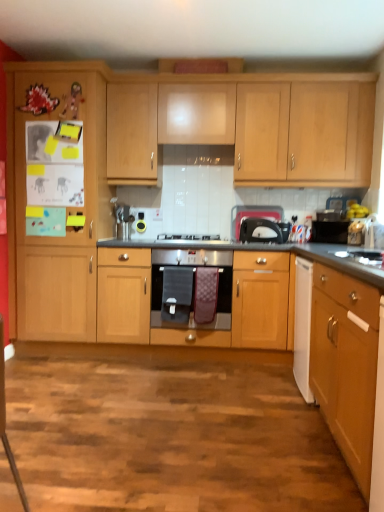
Find the location of a particular element. The width and height of the screenshot is (384, 512). matte black toaster at center is located at coordinates pyautogui.click(x=252, y=215).

Identify the location of satin silver gas stove at center. Image resolution: width=384 pixels, height=512 pixels. (188, 237).

Describe the element at coordinates (64, 205) in the screenshot. The width and height of the screenshot is (384, 512). I see `wooden cabinet at left, the 2th cabinetry in the back-to-front sequence` at that location.

Describe the element at coordinates (191, 312) in the screenshot. I see `wooden cabinet at center, acting as the 3th cabinetry starting from the back` at that location.

Measure the distance between point (344, 327) and camera.

The distance of point (344, 327) from camera is 1.73 meters.

I want to click on matte black toaster at center, so click(252, 215).

Considering the relative sizes of matte black toaster at center and satin silver gas stove at center in the image provided, is matte black toaster at center smaller than satin silver gas stove at center?

Correct, matte black toaster at center occupies less space than satin silver gas stove at center.

Is matte black toaster at center next to satin silver gas stove at center?

No, matte black toaster at center is not in contact with satin silver gas stove at center.

In the image, is matte black toaster at center on the left side or the right side of satin silver gas stove at center?

Clearly, matte black toaster at center is on the right of satin silver gas stove at center in the image.

From the image's perspective, which object appears higher, matte black toaster at center or satin silver gas stove at center?

matte black toaster at center, from the image's perspective.

From the image's perspective, which one is positioned lower, light wood cabinet at upper center, the 4th cabinetry positioned from the front, or satin silver gas stove at center?

satin silver gas stove at center.

In the scene shown: Is satin silver gas stove at center completely or partially inside light wood cabinet at upper center, the 4th cabinetry positioned from the front?

No, satin silver gas stove at center is not a part of light wood cabinet at upper center, the 4th cabinetry positioned from the front.

Is point (293, 125) in front of point (218, 237)?

Yes, point (293, 125) is closer to viewer.

Considering the positions of objects matte black toaster at center and white glossy sink at right in the image provided, who is in front, matte black toaster at center or white glossy sink at right?

Positioned in front is white glossy sink at right.

This screenshot has width=384, height=512. What are the coordinates of `sink in front of the matte black toaster at center` in the screenshot? It's located at (361, 257).

Is matte black toaster at center not near white glossy sink at right?

No, matte black toaster at center is in close proximity to white glossy sink at right.

Considering the positions of point (287, 268) and point (365, 255), is point (287, 268) closer or farther from the camera than point (365, 255)?

Point (287, 268) is positioned farther from the camera compared to point (365, 255).

Is wooden cabinet at center, which is the 2th cabinetry in front-to-back order, facing away from white glossy sink at right?

wooden cabinet at center, which is the 2th cabinetry in front-to-back order, is not turned away from white glossy sink at right.

Where is `sink above the wooden cabinet at center, acting as the 3th cabinetry starting from the back (from the image's perspective)`? Image resolution: width=384 pixels, height=512 pixels. sink above the wooden cabinet at center, acting as the 3th cabinetry starting from the back (from the image's perspective) is located at coordinates (361, 257).

Is satin silver gas stove at center positioned far away from wooden cabinet at center, acting as the 3th cabinetry starting from the back?

Actually, satin silver gas stove at center and wooden cabinet at center, acting as the 3th cabinetry starting from the back, are a little close together.

Visually, is satin silver gas stove at center positioned to the left or to the right of wooden cabinet at center, acting as the 3th cabinetry starting from the back?

From the image, it's evident that satin silver gas stove at center is to the left of wooden cabinet at center, acting as the 3th cabinetry starting from the back.

Would you say satin silver gas stove at center is outside wooden cabinet at center, which is the 2th cabinetry in front-to-back order?

Indeed, satin silver gas stove at center is completely outside wooden cabinet at center, which is the 2th cabinetry in front-to-back order.

Considering the sizes of objects satin silver gas stove at center and wooden cabinet at center, acting as the 3th cabinetry starting from the back, in the image provided, who is bigger, satin silver gas stove at center or wooden cabinet at center, acting as the 3th cabinetry starting from the back,?

wooden cabinet at center, acting as the 3th cabinetry starting from the back, is bigger.

Does wooden cabinet at left, the 2th cabinetry in the back-to-front sequence, turn towards white glossy sink at right?

No, wooden cabinet at left, the 2th cabinetry in the back-to-front sequence, is not oriented towards white glossy sink at right.

Is wooden cabinet at left, the 2th cabinetry in the back-to-front sequence, in front of or behind white glossy sink at right in the image?

In the image, wooden cabinet at left, the 2th cabinetry in the back-to-front sequence, appears behind white glossy sink at right.

Is wooden cabinet at left, which is counted as the third cabinetry, starting from the front, at the left side of white glossy sink at right?

Correct, you'll find wooden cabinet at left, which is counted as the third cabinetry, starting from the front, to the left of white glossy sink at right.

Is white glossy sink at right completely or partially inside wooden cabinet at left, the 2th cabinetry in the back-to-front sequence?

That's incorrect, white glossy sink at right is not inside wooden cabinet at left, the 2th cabinetry in the back-to-front sequence.

Which of these two, satin silver gas stove at center or light wood cabinet at upper center, which appears as the 1th cabinetry when viewed from the back, stands taller?

With more height is light wood cabinet at upper center, which appears as the 1th cabinetry when viewed from the back.

Where is `cabinetry lying behind the satin silver gas stove at center`? The image size is (384, 512). cabinetry lying behind the satin silver gas stove at center is located at coordinates (249, 127).

In the scene shown: Between satin silver gas stove at center and light wood cabinet at upper center, the 4th cabinetry positioned from the front, which one has smaller size?

satin silver gas stove at center is smaller.

From a real-world perspective, is satin silver gas stove at center physically below light wood cabinet at upper center, the 4th cabinetry positioned from the front?

Yes.

In the image, there is a matte black toaster at center. What are the coordinates of `gas stove below it (from a real-world perspective)` in the screenshot? It's located at (188, 237).

Locate an element on the screen. This screenshot has height=512, width=384. the 2nd cabinetry above the satin silver gas stove at center (from the image's perspective) is located at coordinates (249, 127).

Looking at the image, which one is located further to wooden cabinet at left, which is counted as the third cabinetry, starting from the front, wooden cabinet at lower right, the 4th cabinetry when ordered from back to front, or light wood cabinet at upper center, which appears as the 1th cabinetry when viewed from the back?

Based on the image, wooden cabinet at lower right, the 4th cabinetry when ordered from back to front, appears to be further to wooden cabinet at left, which is counted as the third cabinetry, starting from the front.

When comparing their distances from white glossy sink at right, does matte black toaster at center or wooden cabinet at lower right, the 4th cabinetry when ordered from back to front, seem closer?

wooden cabinet at lower right, the 4th cabinetry when ordered from back to front.

Based on their spatial positions, is stainless steel oven at center or light wood cabinet at upper center, the 4th cabinetry positioned from the front, closer to wooden cabinet at left, which is counted as the third cabinetry, starting from the front?

The object closer to wooden cabinet at left, which is counted as the third cabinetry, starting from the front, is stainless steel oven at center.

Looking at the image, which one is located further to wooden cabinet at center, which is the 2th cabinetry in front-to-back order, matte black toaster at center or satin silver gas stove at center?

matte black toaster at center lies further to wooden cabinet at center, which is the 2th cabinetry in front-to-back order, than the other object.

Estimate the real-world distances between objects in this image. Which object is further from wooden cabinet at lower right, the 4th cabinetry when ordered from back to front, light wood cabinet at upper center, the 4th cabinetry positioned from the front, or white glossy sink at right?

light wood cabinet at upper center, the 4th cabinetry positioned from the front.

From the image, which object appears to be farther from wooden cabinet at center, acting as the 3th cabinetry starting from the back, wooden cabinet at left, which is counted as the third cabinetry, starting from the front, or matte black toaster at center?

wooden cabinet at left, which is counted as the third cabinetry, starting from the front, is positioned further to the anchor wooden cabinet at center, acting as the 3th cabinetry starting from the back.

Estimate the real-world distances between objects in this image. Which object is further from light wood cabinet at upper center, the 4th cabinetry positioned from the front, wooden cabinet at center, acting as the 3th cabinetry starting from the back, or stainless steel oven at center?

Answer: stainless steel oven at center is further to light wood cabinet at upper center, the 4th cabinetry positioned from the front.

Estimate the real-world distances between objects in this image. Which object is further from stainless steel oven at center, matte black toaster at center or light wood cabinet at upper center, the 4th cabinetry positioned from the front?

The object further to stainless steel oven at center is light wood cabinet at upper center, the 4th cabinetry positioned from the front.

Image resolution: width=384 pixels, height=512 pixels. Identify the location of sink positioned between wooden cabinet at lower right, the 4th cabinetry when ordered from back to front, and matte black toaster at center from near to far. (361, 257).

Image resolution: width=384 pixels, height=512 pixels. I want to click on gas stove between light wood cabinet at upper center, the 4th cabinetry positioned from the front, and stainless steel oven at center, in the vertical direction, so click(188, 237).

Find the location of a particular element. gas stove between wooden cabinet at left, which is counted as the third cabinetry, starting from the front, and wooden cabinet at center, acting as the 3th cabinetry starting from the back, from left to right is located at coordinates (188, 237).

In order to click on kitchen appliance between matte black toaster at center and wooden cabinet at center, which is the 2th cabinetry in front-to-back order, from top to bottom in this screenshot , I will do `click(193, 283)`.